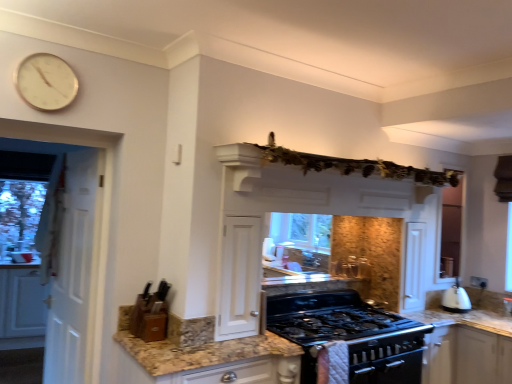
Question: Is white matte exhaust hood at upper center situated inside white matte cabinet at left or outside?

Choices:
 (A) inside
 (B) outside

Answer: (B)

Question: Looking at their shapes, would you say white matte exhaust hood at upper center is wider or thinner than white matte cabinet at left?

Choices:
 (A) wide
 (B) thin

Answer: (B)

Question: Which is farther from the white matte cabinet at left?

Choices:
 (A) white wooden door at left
 (B) granite at left
 (C) wooden knife block at lower left, the first appliance in the top-to-bottom sequence
 (D) white glossy kettle at right
 (E) white wooden clock at upper left

Answer: (D)

Question: Which object is the closest to the wooden knife block at lower left, the 2th appliance when ordered from bottom to top?

Choices:
 (A) white glossy kettle at right
 (B) white matte cabinet at left
 (C) granite at left
 (D) white matte exhaust hood at upper center
 (E) white wooden door at left

Answer: (C)